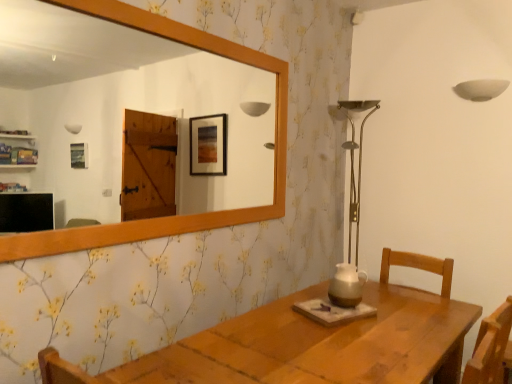
In order to face wooden mirror at upper center, should I rotate leftwards or rightwards?

It's best to rotate left around 9.196 degrees.

This screenshot has height=384, width=512. Describe the element at coordinates (125, 107) in the screenshot. I see `wooden mirror at upper center` at that location.

The width and height of the screenshot is (512, 384). I want to click on wooden mirror at upper center, so click(x=125, y=107).

You are a GUI agent. You are given a task and a screenshot of the screen. Output one action in this format:
    pyautogui.click(x=<x>, y=<y>)
    Task: Click on the brown ceramic pitcher at center
    
    Given the screenshot: What is the action you would take?
    pyautogui.click(x=346, y=286)

Measure the distance between point [342,291] and camera.

Point [342,291] and camera are 1.84 meters apart.

Measure the distance between brown ceramic pitcher at center and camera.

brown ceramic pitcher at center and camera are 5.94 feet apart.

Describe the element at coordinates (346, 286) in the screenshot. The height and width of the screenshot is (384, 512). I see `brown ceramic pitcher at center` at that location.

Find the location of `wooden mirror at upper center`. wooden mirror at upper center is located at coordinates (125, 107).

Which is more to the left, brown ceramic pitcher at center or wooden mirror at upper center?

wooden mirror at upper center is more to the left.

Which is behind, brown ceramic pitcher at center or wooden mirror at upper center?

brown ceramic pitcher at center.

Between point (335, 273) and point (37, 55), which one is positioned in front?

The point (335, 273) is in front.

From the image's perspective, which is below, brown ceramic pitcher at center or wooden mirror at upper center?

From the image's view, brown ceramic pitcher at center is below.

Looking at this image, from a real-world perspective, who is located lower, brown ceramic pitcher at center or wooden mirror at upper center?

brown ceramic pitcher at center, from a real-world perspective.

In terms of width, does brown ceramic pitcher at center look wider or thinner when compared to wooden mirror at upper center?

In the image, brown ceramic pitcher at center appears to be wider than wooden mirror at upper center.

Considering the sizes of brown ceramic pitcher at center and wooden mirror at upper center in the image, is brown ceramic pitcher at center taller or shorter than wooden mirror at upper center?

Considering their sizes, brown ceramic pitcher at center has less height than wooden mirror at upper center.

Is brown ceramic pitcher at center smaller than wooden mirror at upper center?

Yes.

Is wooden mirror at upper center a part of brown ceramic pitcher at center?

Definitely not — wooden mirror at upper center is not inside brown ceramic pitcher at center.

Is brown ceramic pitcher at center in contact with wooden mirror at upper center?

brown ceramic pitcher at center is not next to wooden mirror at upper center, and they're not touching.

Is brown ceramic pitcher at center positioned with its back to wooden mirror at upper center?

No, wooden mirror at upper center is not at the back of brown ceramic pitcher at center.

In order to click on candle holder behind the wooden mirror at upper center in this screenshot , I will do `click(346, 286)`.

Can you confirm if wooden mirror at upper center is positioned to the left of brown ceramic pitcher at center?

Yes.

Which object is closer to the camera, wooden mirror at upper center or brown ceramic pitcher at center?

wooden mirror at upper center is closer to the camera.

Between point (252, 152) and point (350, 284), which one is positioned behind?

Point (252, 152)

Based on the photo, from the image's perspective, is wooden mirror at upper center located beneath brown ceramic pitcher at center?

No, from the image's perspective, wooden mirror at upper center is not beneath brown ceramic pitcher at center.

From a real-world perspective, who is located lower, wooden mirror at upper center or brown ceramic pitcher at center?

brown ceramic pitcher at center is physically lower.

Does wooden mirror at upper center have a greater width compared to brown ceramic pitcher at center?

Incorrect, the width of wooden mirror at upper center does not surpass that of brown ceramic pitcher at center.

Considering the sizes of objects wooden mirror at upper center and brown ceramic pitcher at center in the image provided, who is taller, wooden mirror at upper center or brown ceramic pitcher at center?

wooden mirror at upper center.

Does wooden mirror at upper center have a larger size compared to brown ceramic pitcher at center?

Yes, wooden mirror at upper center is bigger than brown ceramic pitcher at center.

Do you think wooden mirror at upper center is within brown ceramic pitcher at center, or outside of it?

wooden mirror at upper center lies outside brown ceramic pitcher at center.

Is wooden mirror at upper center not close to brown ceramic pitcher at center?

wooden mirror at upper center is far away from brown ceramic pitcher at center.

Could you tell me if wooden mirror at upper center is facing brown ceramic pitcher at center?

No, wooden mirror at upper center is not turned towards brown ceramic pitcher at center.

How far apart are wooden mirror at upper center and brown ceramic pitcher at center?

A distance of 3.41 meters exists between wooden mirror at upper center and brown ceramic pitcher at center.

Locate an element on the screen. This screenshot has width=512, height=384. candle holder located behind the wooden mirror at upper center is located at coordinates (346, 286).

Locate an element on the screen. mirror above the brown ceramic pitcher at center (from the image's perspective) is located at coordinates (125, 107).

Image resolution: width=512 pixels, height=384 pixels. I want to click on candle holder behind the wooden mirror at upper center, so click(346, 286).